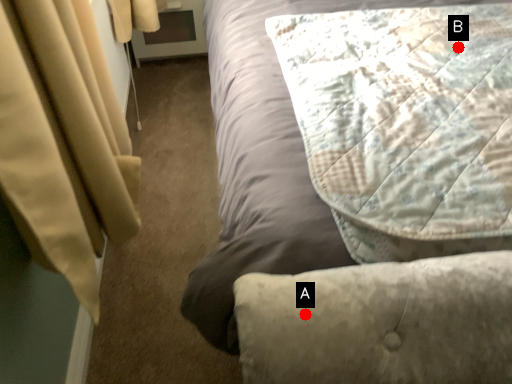
Question: Two points are circled on the image, labeled by A and B beside each circle. Which point is closer to the camera taking this photo?

Choices:
 (A) A is closer
 (B) B is closer

Answer: (A)